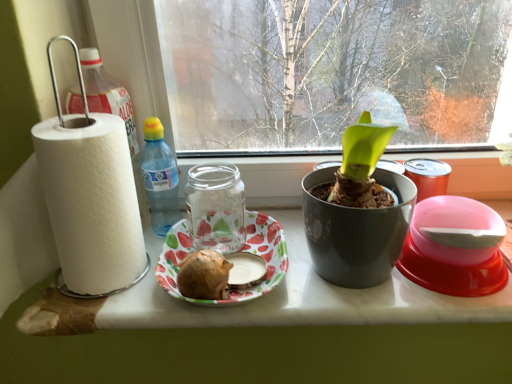
This screenshot has width=512, height=384. I want to click on free location above white paper towel at left (from a real-world perspective), so click(x=263, y=261).